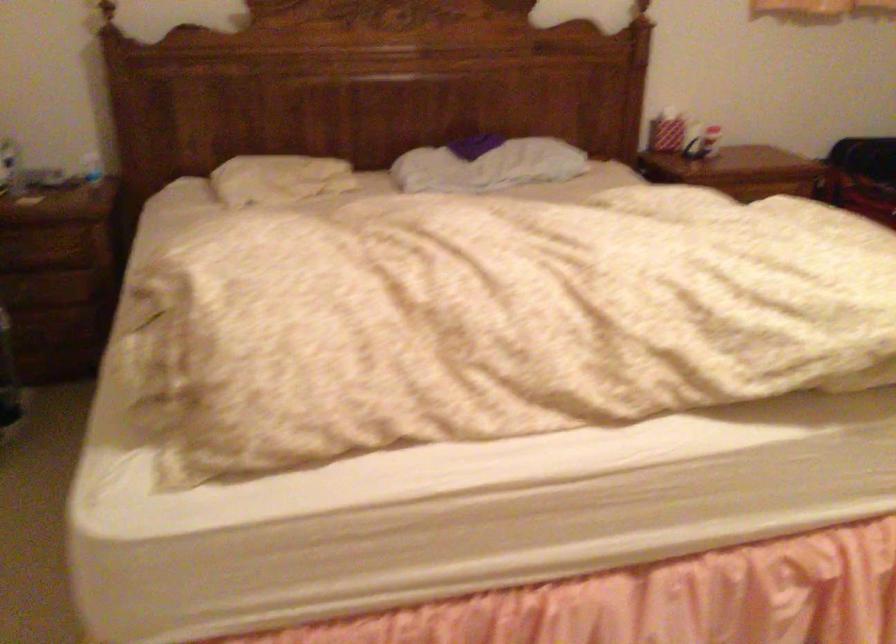
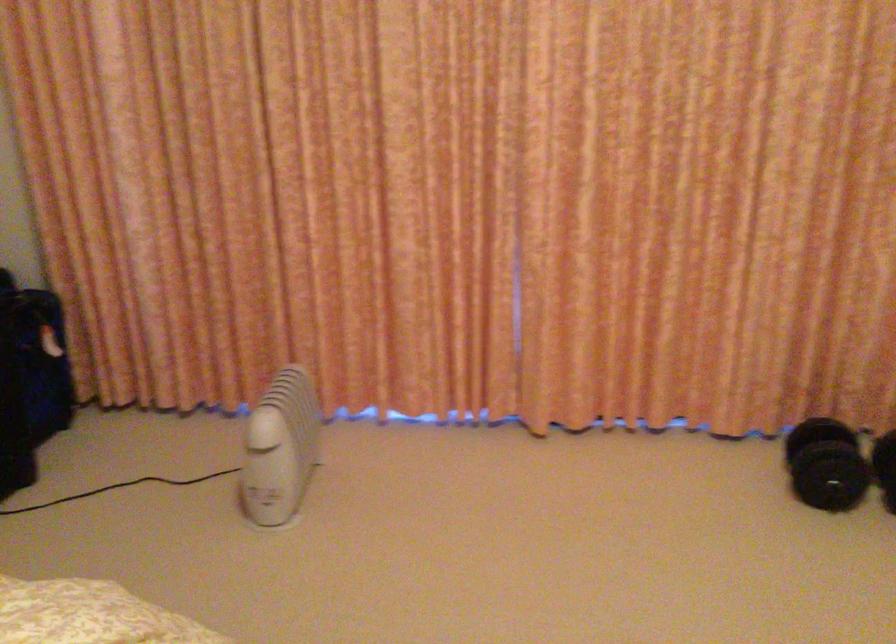
Question: The first image is from the beginning of the video and the second image is from the end. How did the camera likely rotate when shooting the video?

Choices:
 (A) Left
 (B) Right
 (C) Up
 (D) Down

Answer: (B)